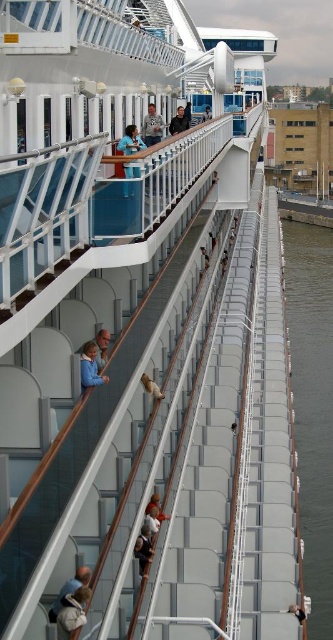
Which is in front, point (314, 477) or point (136, 170)?

Point (136, 170) is in front.

Between clear water at right and blue fabric shirt at upper center, which one is positioned lower?

Positioned lower is clear water at right.

The width and height of the screenshot is (333, 640). In order to click on clear water at right in this screenshot , I will do pos(313,406).

Between leather backpack at lower left and black leather jacket at lower center, which one appears on the right side from the viewer's perspective?

Positioned to the right is black leather jacket at lower center.

Between leather backpack at lower left and black leather jacket at lower center, which one is positioned higher?

Positioned higher is leather backpack at lower left.

Who is more distant from viewer, (63, 624) or (294, 605)?

The point (294, 605) is behind.

Image resolution: width=333 pixels, height=640 pixels. I want to click on leather backpack at lower left, so click(x=71, y=612).

The height and width of the screenshot is (640, 333). I want to click on blue fabric shirt at upper center, so click(129, 141).

Is point (134, 150) positioned in front of point (299, 609)?

That is False.

Find the location of a particular element. Image resolution: width=333 pixels, height=640 pixels. blue fabric shirt at upper center is located at coordinates (129, 141).